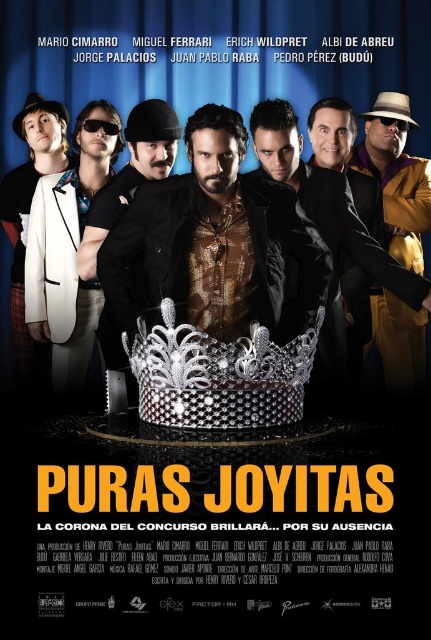
Question: Which object is farther from the camera taking this photo?

Choices:
 (A) sunglasses at left
 (B) silver metallic crown at center

Answer: (A)

Question: Is silver metallic crown at center bigger than sunglasses at left?

Choices:
 (A) yes
 (B) no

Answer: (B)

Question: Does silver metallic crown at center lie behind sunglasses at left?

Choices:
 (A) yes
 (B) no

Answer: (B)

Question: Is silver metallic crown at center to the right of sunglasses at left from the viewer's perspective?

Choices:
 (A) no
 (B) yes

Answer: (B)

Question: Which point is closer to the camera taking this photo?

Choices:
 (A) (63, 173)
 (B) (146, 401)

Answer: (B)

Question: Which point appears farthest from the camera in this image?

Choices:
 (A) (225, 403)
 (B) (71, 284)

Answer: (B)